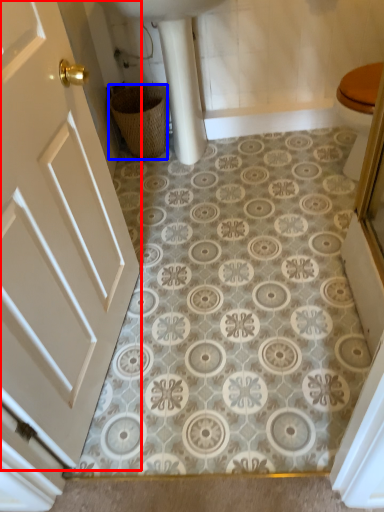
Question: Which of the following is the farthest to the observer, door (highlighted by a red box) or basket (highlighted by a blue box)?

Choices:
 (A) door
 (B) basket

Answer: (B)